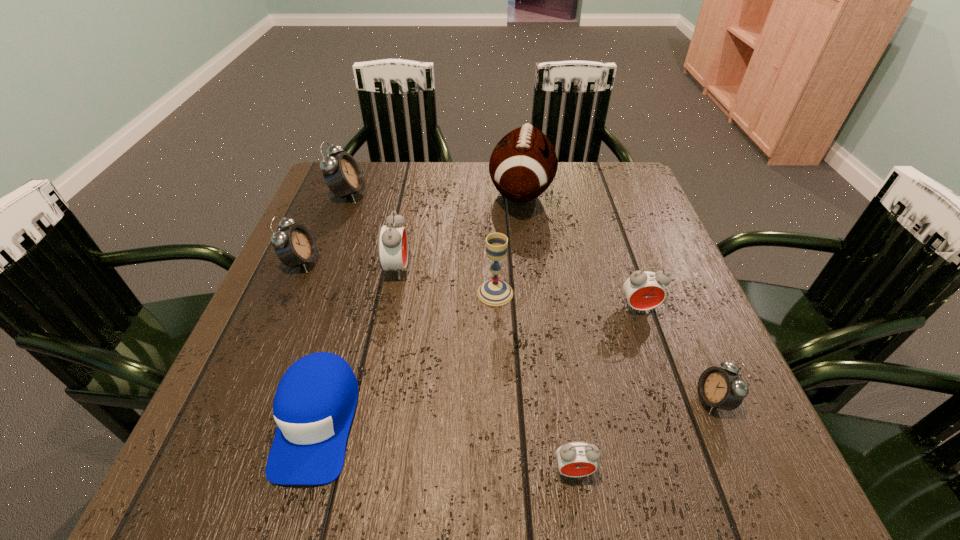
The height and width of the screenshot is (540, 960). Identify the location of alarm clock that is the closest to the fifth farthest alarm clock. (644, 290).

Locate an element on the screen. The width and height of the screenshot is (960, 540). the third closest white alarm clock relative to the nearest alarm clock is located at coordinates (342, 174).

Identify which white alarm clock is the second nearest to the biggest white alarm clock. Please provide its 2D coordinates. Your answer should be formatted as a tuple, i.e. [(x, y)], where the tuple contains the x and y coordinates of a point satisfying the conditions above.

[(720, 388)]

Point out which red alarm clock is positioned as the nearest to the gray chalice. Please provide its 2D coordinates. Your answer should be formatted as a tuple, i.e. [(x, y)], where the tuple contains the x and y coordinates of a point satisfying the conditions above.

[(392, 246)]

Locate which red alarm clock is the second closest to the football (American). Please provide its 2D coordinates. Your answer should be formatted as a tuple, i.e. [(x, y)], where the tuple contains the x and y coordinates of a point satisfying the conditions above.

[(644, 290)]

Image resolution: width=960 pixels, height=540 pixels. I want to click on vacant space that satisfies the following two spatial constraints: 1. on the face of the second nearest alarm clock; 2. on the front-facing side of the baseball cap, so click(722, 421).

This screenshot has height=540, width=960. I want to click on free space that satisfies the following two spatial constraints: 1. on the front side of the tallest object; 2. on the face of the second smallest white alarm clock, so click(x=530, y=262).

The height and width of the screenshot is (540, 960). What are the coordinates of `vacant area that satisfies the following two spatial constraints: 1. on the face of the fourth alarm clock from right to left; 2. on the front-facing side of the blue baseball cap` in the screenshot? It's located at (367, 421).